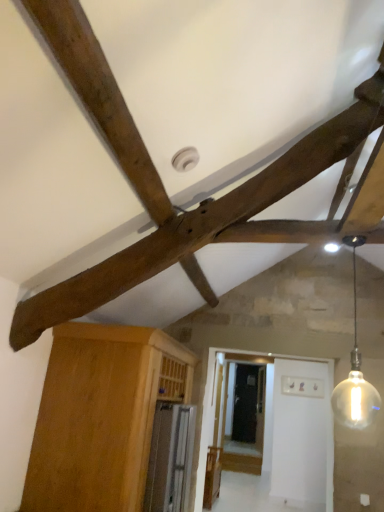
Question: Does wooden beam at upper center appear on the right side of translucent glass bulb at upper right?

Choices:
 (A) yes
 (B) no

Answer: (B)

Question: Considering the relative positions of wooden beam at upper center and translucent glass bulb at upper right in the image provided, is wooden beam at upper center in front of translucent glass bulb at upper right?

Choices:
 (A) yes
 (B) no

Answer: (B)

Question: Would you consider wooden beam at upper center to be distant from translucent glass bulb at upper right?

Choices:
 (A) yes
 (B) no

Answer: (A)

Question: Considering the relative sizes of wooden beam at upper center and translucent glass bulb at upper right in the image provided, is wooden beam at upper center shorter than translucent glass bulb at upper right?

Choices:
 (A) yes
 (B) no

Answer: (B)

Question: Would you say wooden beam at upper center is outside translucent glass bulb at upper right?

Choices:
 (A) yes
 (B) no

Answer: (A)

Question: Looking at the image, does translucent glass bulb at upper right seem bigger or smaller compared to wooden beam at upper center?

Choices:
 (A) small
 (B) big

Answer: (A)

Question: From a real-world perspective, is translucent glass bulb at upper right positioned above or below wooden beam at upper center?

Choices:
 (A) above
 (B) below

Answer: (B)

Question: Is point (362, 404) closer or farther from the camera than point (326, 164)?

Choices:
 (A) closer
 (B) farther

Answer: (B)

Question: From the image's perspective, relative to wooden beam at upper center, is translucent glass bulb at upper right above or below?

Choices:
 (A) below
 (B) above

Answer: (A)

Question: Does point (365, 395) appear closer or farther from the camera than point (170, 344)?

Choices:
 (A) closer
 (B) farther

Answer: (B)

Question: In terms of height, does translucent glass bulb at upper right look taller or shorter compared to wooden cabinet at lower left?

Choices:
 (A) short
 (B) tall

Answer: (A)

Question: Considering the relative positions of translucent glass bulb at upper right and wooden cabinet at lower left in the image provided, is translucent glass bulb at upper right to the left or to the right of wooden cabinet at lower left?

Choices:
 (A) right
 (B) left

Answer: (A)

Question: From the image's perspective, is translucent glass bulb at upper right above or below wooden cabinet at lower left?

Choices:
 (A) above
 (B) below

Answer: (A)

Question: Relative to translucent glass bulb at upper right, is wooden cabinet at lower left in front or behind?

Choices:
 (A) front
 (B) behind

Answer: (B)

Question: Would you say wooden cabinet at lower left is to the left or to the right of translucent glass bulb at upper right in the picture?

Choices:
 (A) right
 (B) left

Answer: (B)